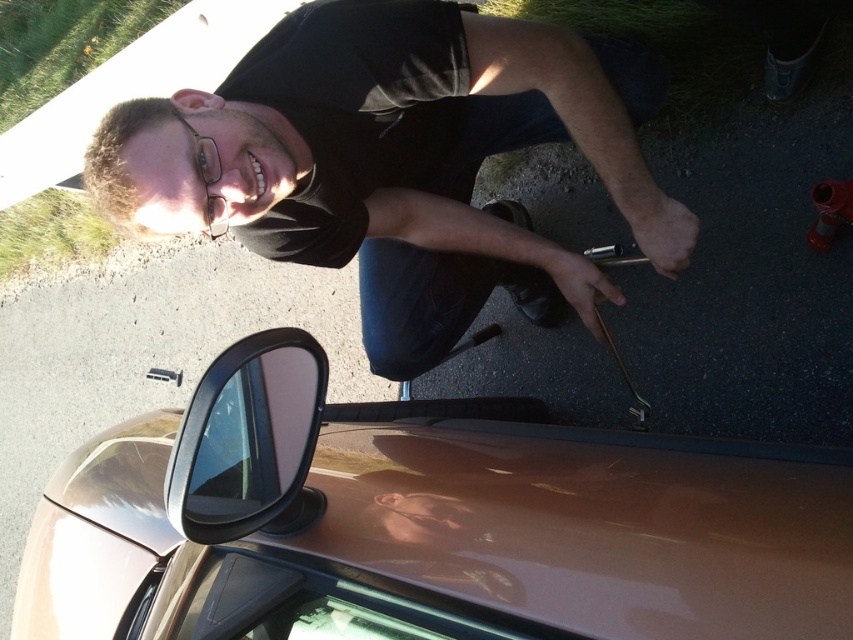
Question: Can you confirm if glossy metallic car at lower center is wider than black matte shirt at upper center?

Choices:
 (A) yes
 (B) no

Answer: (A)

Question: Which object is the closest to the black matte shirt at upper center?

Choices:
 (A) glossy black side mirror at lower left
 (B) glossy metallic car at lower center

Answer: (B)

Question: Can you confirm if glossy metallic car at lower center is positioned to the right of black matte shirt at upper center?

Choices:
 (A) yes
 (B) no

Answer: (B)

Question: Which object is the farthest from the glossy black side mirror at lower left?

Choices:
 (A) glossy metallic car at lower center
 (B) black matte shirt at upper center

Answer: (B)

Question: Which object is positioned farthest from the black matte shirt at upper center?

Choices:
 (A) glossy metallic car at lower center
 (B) glossy black side mirror at lower left

Answer: (B)

Question: Can you confirm if glossy metallic car at lower center is positioned to the left of black matte shirt at upper center?

Choices:
 (A) no
 (B) yes

Answer: (B)